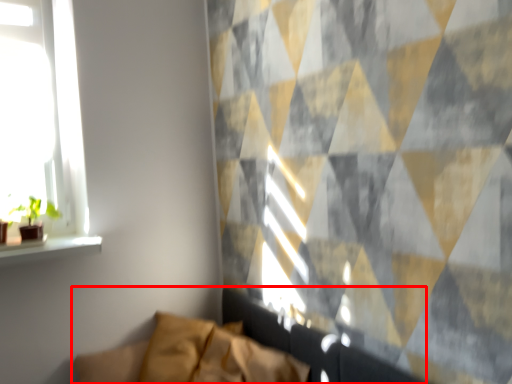
Question: From the image's perspective, considering the relative positions of couch (annotated by the red box) and houseplant in the image provided, where is couch (annotated by the red box) located with respect to the staircase?

Choices:
 (A) below
 (B) above

Answer: (A)